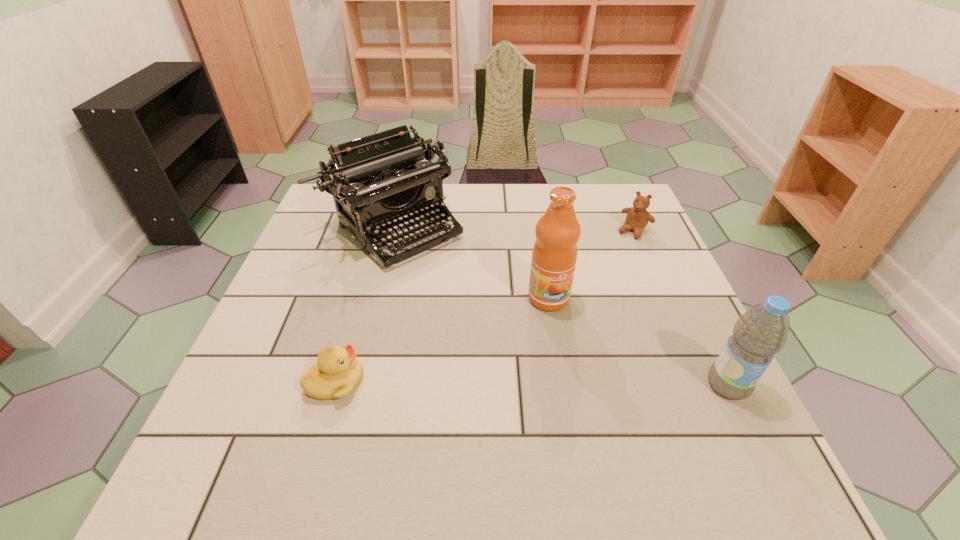
At what (x,y) coordinates should I click in order to perform the action: click on the shortest object. Please return your answer as a coordinate pair (x, y). This screenshot has width=960, height=540. Looking at the image, I should click on (337, 372).

The height and width of the screenshot is (540, 960). Find the location of `water bottle`. water bottle is located at coordinates (761, 332).

You are a GUI agent. You are given a task and a screenshot of the screen. Output one action in this format:
    pyautogui.click(x=<x>, y=<y>)
    Task: Click on the fruit juice
    
    Given the screenshot: What is the action you would take?
    pyautogui.click(x=554, y=255)

Identify the location of the third farthest object. (554, 255).

What are the coordinates of `typewriter` in the screenshot? It's located at (383, 181).

What are the coordinates of `teddy bear` in the screenshot? It's located at (637, 218).

Find the location of a particular element. The image size is (960, 540). vacant region located on the front-facing side of the duckling is located at coordinates (529, 381).

Find the location of `vacant space located on the left of the water bottle`. vacant space located on the left of the water bottle is located at coordinates (655, 384).

Identify the location of vacant space located on the label side of the tallest object. (585, 375).

At what (x,y) coordinates should I click in order to perform the action: click on free space located 0.130m on the label side of the tallest object. Please return your answer as a coordinate pair (x, y). Looking at the image, I should click on (577, 359).